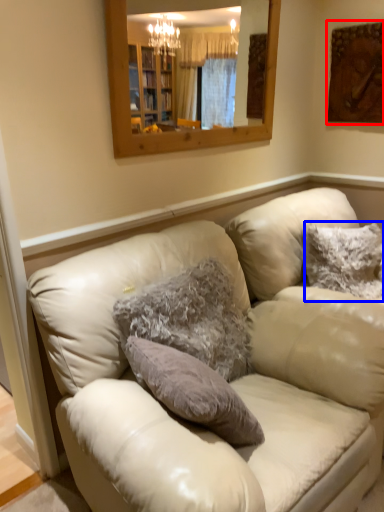
Question: Which of the following is the closest to the observer, picture frame (highlighted by a red box) or pillow (highlighted by a blue box)?

Choices:
 (A) picture frame
 (B) pillow

Answer: (B)